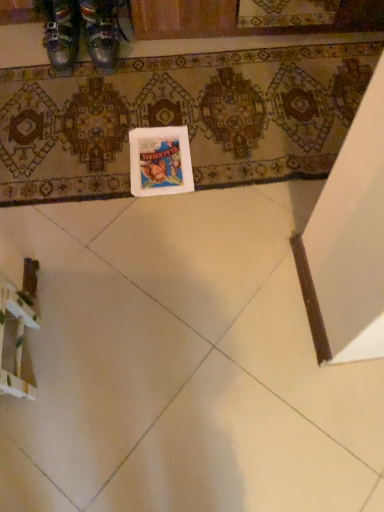
Measure the distance between white matte postcard at center and camera.

The depth of white matte postcard at center is 4.59 feet.

You are a GUI agent. You are given a task and a screenshot of the screen. Output one action in this format:
    pyautogui.click(x=<x>, y=<y>)
    Task: Click on the white glossy tile at lower left
    This screenshot has height=512, width=384.
    Given the screenshot: What is the action you would take?
    pyautogui.click(x=86, y=362)

The width and height of the screenshot is (384, 512). Find the location of `footwear below the metallic leather shoes at upper left, which ranks as the second footwear in right-to-left order (from a real-world perspective)`. footwear below the metallic leather shoes at upper left, which ranks as the second footwear in right-to-left order (from a real-world perspective) is located at coordinates (102, 32).

Considering the relative sizes of metallic leather shoes at upper left, which is counted as the first footwear, starting from the left, and metallic leather shoes at upper left, arranged as the second footwear when viewed from the left, in the image provided, is metallic leather shoes at upper left, which is counted as the first footwear, starting from the left, shorter than metallic leather shoes at upper left, arranged as the second footwear when viewed from the left,?

Yes.

From the image's perspective, is metallic leather shoes at upper left, which is counted as the first footwear, starting from the left, above or below metallic leather shoes at upper left, the 1th footwear from the right?

Clearly, from the image's perspective, metallic leather shoes at upper left, which is counted as the first footwear, starting from the left, is below metallic leather shoes at upper left, the 1th footwear from the right.

Considering the sizes of objects metallic leather shoes at upper left, which is counted as the first footwear, starting from the left, and metallic leather shoes at upper left, the 1th footwear from the right, in the image provided, who is thinner, metallic leather shoes at upper left, which is counted as the first footwear, starting from the left, or metallic leather shoes at upper left, the 1th footwear from the right,?

With smaller width is metallic leather shoes at upper left, which is counted as the first footwear, starting from the left.

Which of these two, metallic leather shoes at upper left, the 1th footwear from the right, or white glossy tile at lower left, stands shorter?

white glossy tile at lower left is shorter.

Could you tell me if metallic leather shoes at upper left, the 1th footwear from the right, is facing white glossy tile at lower left?

Yes, metallic leather shoes at upper left, the 1th footwear from the right, is turned towards white glossy tile at lower left.

Which is more to the left, patterned carpet at center or white glossy tile at lower left?

white glossy tile at lower left is more to the left.

Considering the sizes of objects patterned carpet at center and white glossy tile at lower left in the image provided, who is bigger, patterned carpet at center or white glossy tile at lower left?

Bigger between the two is white glossy tile at lower left.

How much distance is there between patterned carpet at center and white glossy tile at lower left?

A distance of 51.71 centimeters exists between patterned carpet at center and white glossy tile at lower left.

From a real-world perspective, is patterned carpet at center on white glossy tile at lower left?

Yes, from a real-world perspective, patterned carpet at center is above white glossy tile at lower left.

How different are the orientations of white matte postcard at center and white glossy tile at lower left in degrees?

180 degrees.

Does white matte postcard at center turn towards white glossy tile at lower left?

Yes, white matte postcard at center is turned towards white glossy tile at lower left.

From the image's perspective, is white matte postcard at center above or below white glossy tile at lower left?

white matte postcard at center is above white glossy tile at lower left.

From a real-world perspective, which object stands above the other?

In real-world perspective, white matte postcard at center is above.

Does metallic leather shoes at upper left, arranged as the second footwear when viewed from the left, turn towards patterned carpet at center?

No, metallic leather shoes at upper left, arranged as the second footwear when viewed from the left, is not aimed at patterned carpet at center.

Which is more to the right, metallic leather shoes at upper left, the 1th footwear from the right, or patterned carpet at center?

patterned carpet at center is more to the right.

From a real-world perspective, between metallic leather shoes at upper left, arranged as the second footwear when viewed from the left, and patterned carpet at center, who is vertically higher?

metallic leather shoes at upper left, arranged as the second footwear when viewed from the left, from a real-world perspective.

This screenshot has width=384, height=512. What are the coordinates of `bath mat located below the metallic leather shoes at upper left, arranged as the second footwear when viewed from the left (from the image's perspective)` in the screenshot? It's located at (180, 118).

In terms of height, does metallic leather shoes at upper left, which ranks as the second footwear in right-to-left order, look taller or shorter compared to patterned carpet at center?

metallic leather shoes at upper left, which ranks as the second footwear in right-to-left order, is taller than patterned carpet at center.

This screenshot has width=384, height=512. What are the coordinates of `the 2nd footwear positioned above the patterned carpet at center (from a real-world perspective)` in the screenshot? It's located at (61, 33).

Considering the points (75, 22) and (162, 117), which point is behind, point (75, 22) or point (162, 117)?

The point (75, 22) is behind.

Is white matte postcard at center facing away from patterned carpet at center?

Correct, white matte postcard at center is looking away from patterned carpet at center.

How distant is white matte postcard at center from patterned carpet at center?

white matte postcard at center is 9.33 inches away from patterned carpet at center.

Is white matte postcard at center inside or outside of patterned carpet at center?

The correct answer is: inside.

Is white matte postcard at center at the left side of patterned carpet at center?

Correct, you'll find white matte postcard at center to the left of patterned carpet at center.

In order to click on footwear that is above the metallic leather shoes at upper left, the 1th footwear from the right (from a real-world perspective) in this screenshot , I will do `click(61, 33)`.

Where is `the 2nd footwear above the white glossy tile at lower left (from the image's perspective)`? This screenshot has width=384, height=512. the 2nd footwear above the white glossy tile at lower left (from the image's perspective) is located at coordinates (102, 32).

Estimate the real-world distances between objects in this image. Which object is further from white matte postcard at center, metallic leather shoes at upper left, which is counted as the first footwear, starting from the left, or white glossy tile at lower left?

metallic leather shoes at upper left, which is counted as the first footwear, starting from the left, is positioned further to the anchor white matte postcard at center.

When comparing their distances from white matte postcard at center, does white glossy tile at lower left or metallic leather shoes at upper left, which ranks as the second footwear in right-to-left order, seem further?

metallic leather shoes at upper left, which ranks as the second footwear in right-to-left order.

From the image, which object appears to be nearer to patterned carpet at center, white matte postcard at center or white glossy tile at lower left?

Based on the image, white matte postcard at center appears to be nearer to patterned carpet at center.

Looking at the image, which one is located further to metallic leather shoes at upper left, the 1th footwear from the right, patterned carpet at center or white matte postcard at center?

Among the two, white matte postcard at center is located further to metallic leather shoes at upper left, the 1th footwear from the right.

When comparing their distances from patterned carpet at center, does white glossy tile at lower left or metallic leather shoes at upper left, the 1th footwear from the right, seem closer?

Based on the image, metallic leather shoes at upper left, the 1th footwear from the right, appears to be nearer to patterned carpet at center.

Looking at the image, which one is located closer to white matte postcard at center, metallic leather shoes at upper left, arranged as the second footwear when viewed from the left, or metallic leather shoes at upper left, which ranks as the second footwear in right-to-left order?

Among the two, metallic leather shoes at upper left, arranged as the second footwear when viewed from the left, is located nearer to white matte postcard at center.

Which object lies nearer to the anchor point white glossy tile at lower left, white matte postcard at center or metallic leather shoes at upper left, the 1th footwear from the right?

white matte postcard at center is closer to white glossy tile at lower left.

From the image, which object appears to be farther from metallic leather shoes at upper left, which ranks as the second footwear in right-to-left order, patterned carpet at center or white matte postcard at center?

white matte postcard at center.

Where is `footwear between metallic leather shoes at upper left, arranged as the second footwear when viewed from the left, and white matte postcard at center, in the vertical direction`? This screenshot has width=384, height=512. footwear between metallic leather shoes at upper left, arranged as the second footwear when viewed from the left, and white matte postcard at center, in the vertical direction is located at coordinates (61, 33).

You are a GUI agent. You are given a task and a screenshot of the screen. Output one action in this format:
    pyautogui.click(x=<x>, y=<y>)
    Task: Click on the bath mat between metallic leather shoes at upper left, the 1th footwear from the right, and white matte postcard at center, in the vertical direction
    This screenshot has width=384, height=512.
    Given the screenshot: What is the action you would take?
    pyautogui.click(x=180, y=118)

Where is `postcard between metallic leather shoes at upper left, which ranks as the second footwear in right-to-left order, and patterned carpet at center from left to right`? The height and width of the screenshot is (512, 384). postcard between metallic leather shoes at upper left, which ranks as the second footwear in right-to-left order, and patterned carpet at center from left to right is located at coordinates (160, 161).

Image resolution: width=384 pixels, height=512 pixels. In order to click on postcard between patterned carpet at center and white glossy tile at lower left in the vertical direction in this screenshot , I will do `click(160, 161)`.